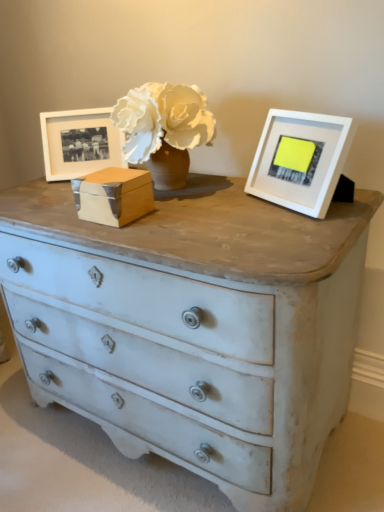
Question: Is matte white picture frame at left, the 2th picture frame from the front, closer to the viewer compared to wooden box at center?

Choices:
 (A) no
 (B) yes

Answer: (A)

Question: Is matte white picture frame at left, which is counted as the 1th picture frame, starting from the left, directly adjacent to wooden box at center?

Choices:
 (A) yes
 (B) no

Answer: (B)

Question: From the image's perspective, is matte white picture frame at left, the 2th picture frame from the front, beneath wooden box at center?

Choices:
 (A) no
 (B) yes

Answer: (A)

Question: Does matte white picture frame at left, marked as the 2th picture frame in a right-to-left arrangement, have a greater width compared to wooden box at center?

Choices:
 (A) no
 (B) yes

Answer: (A)

Question: Are matte white picture frame at left, the 2th picture frame from the front, and wooden box at center located far from each other?

Choices:
 (A) no
 (B) yes

Answer: (A)

Question: Can you confirm if matte white picture frame at left, marked as the 2th picture frame in a right-to-left arrangement, is taller than wooden box at center?

Choices:
 (A) yes
 (B) no

Answer: (A)

Question: Is the position of white matte picture frame at upper right, which is the second picture frame from back to front, more distant than that of wooden box at center?

Choices:
 (A) yes
 (B) no

Answer: (B)

Question: Is white matte picture frame at upper right, the first picture frame in the front-to-back sequence, positioned far away from wooden box at center?

Choices:
 (A) no
 (B) yes

Answer: (A)

Question: From a real-world perspective, is white matte picture frame at upper right, the first picture frame in the front-to-back sequence, located beneath wooden box at center?

Choices:
 (A) no
 (B) yes

Answer: (A)

Question: Is wooden box at center surrounded by white matte picture frame at upper right, the 1th picture frame from the right?

Choices:
 (A) yes
 (B) no

Answer: (B)

Question: Can you confirm if white matte picture frame at upper right, the second picture frame viewed from the left, is thinner than wooden box at center?

Choices:
 (A) no
 (B) yes

Answer: (B)

Question: Can you confirm if white matte picture frame at upper right, the second picture frame viewed from the left, is taller than wooden box at center?

Choices:
 (A) no
 (B) yes

Answer: (B)

Question: Would you say wooden box at center is outside matte white picture frame at left, the first picture frame from the back?

Choices:
 (A) no
 (B) yes

Answer: (B)